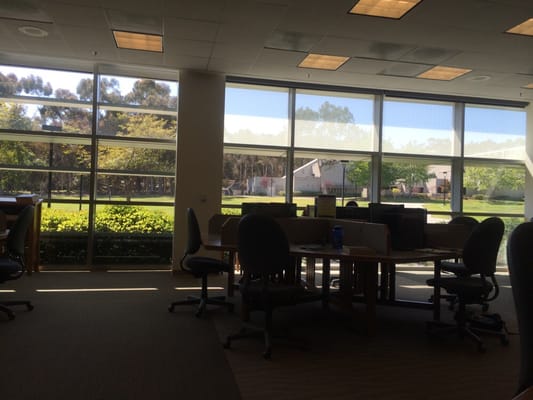
At what (x,y) coordinates should I click in order to perform the action: click on drop ceiling. Please return your answer as a coordinate pair (x, y). Looking at the image, I should click on (200, 25).